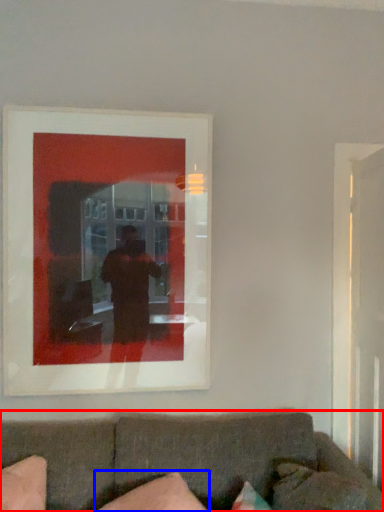
Question: Which of the following is the farthest to the observer, studio couch (highlighted by a red box) or pillow (highlighted by a blue box)?

Choices:
 (A) studio couch
 (B) pillow

Answer: (B)